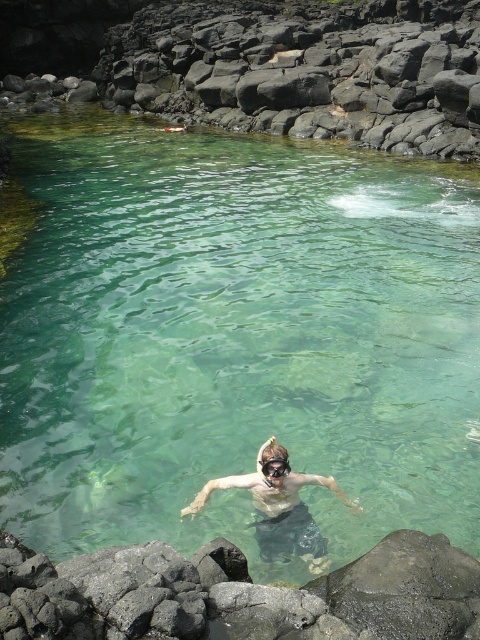
Question: Which point is farther from the camera taking this photo?

Choices:
 (A) (264, 518)
 (B) (144, 144)

Answer: (B)

Question: Among these points, which one is nearest to the camera?

Choices:
 (A) (387, 620)
 (B) (71, 296)
 (C) (35, 48)
 (D) (285, 472)

Answer: (A)

Question: Among these objects, which one is nearest to the camera?

Choices:
 (A) black rock at upper center
 (B) smooth skin diver at center
 (C) transparent rubber goggles at center

Answer: (C)

Question: Can you confirm if dark gray rock at lower center is positioned to the left of smooth skin diver at center?

Choices:
 (A) no
 (B) yes

Answer: (A)

Question: Is smooth skin diver at center below transparent rubber goggles at center?

Choices:
 (A) yes
 (B) no

Answer: (A)

Question: Does clear water at center appear over smooth skin diver at center?

Choices:
 (A) yes
 (B) no

Answer: (A)